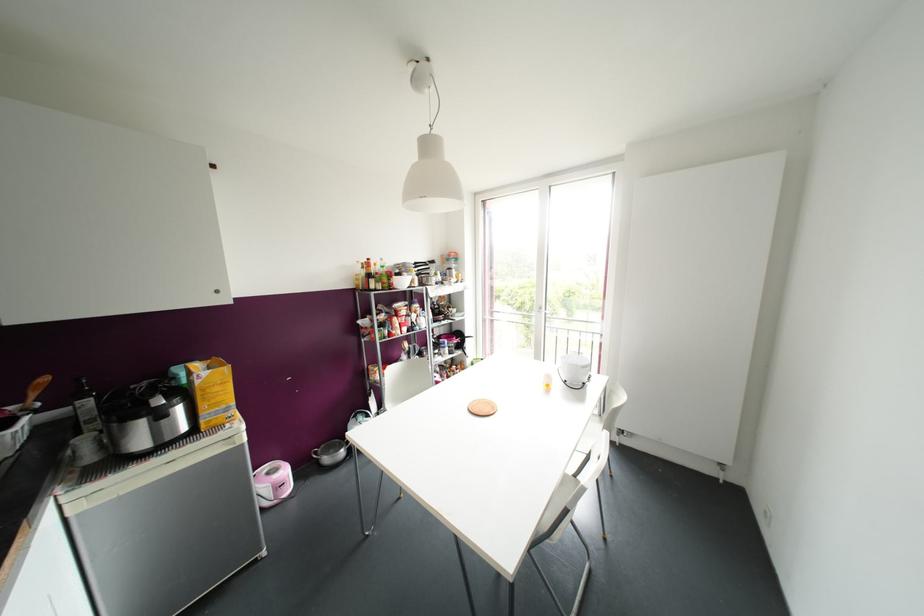
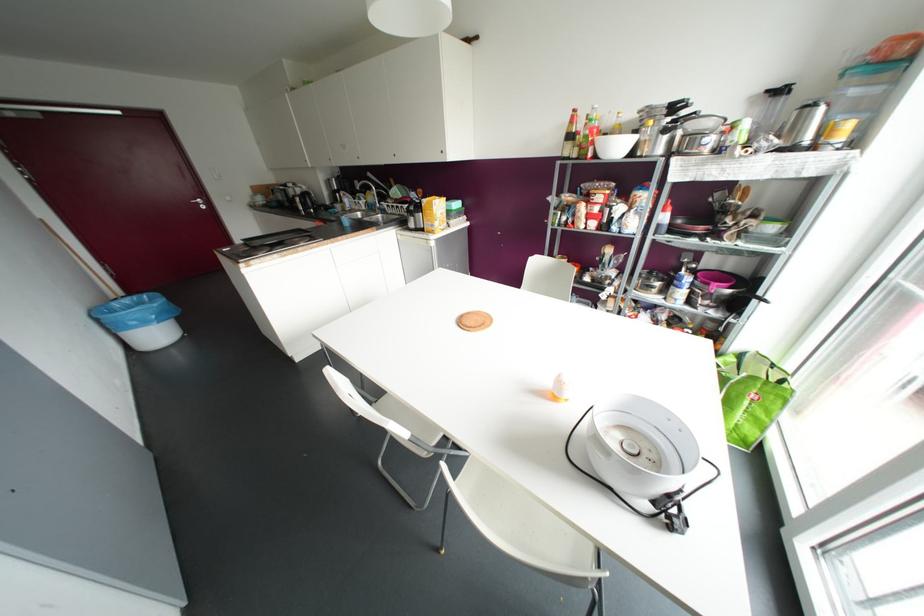
Find the pixel in the second image that matches point (197, 382) in the first image.

(421, 204)